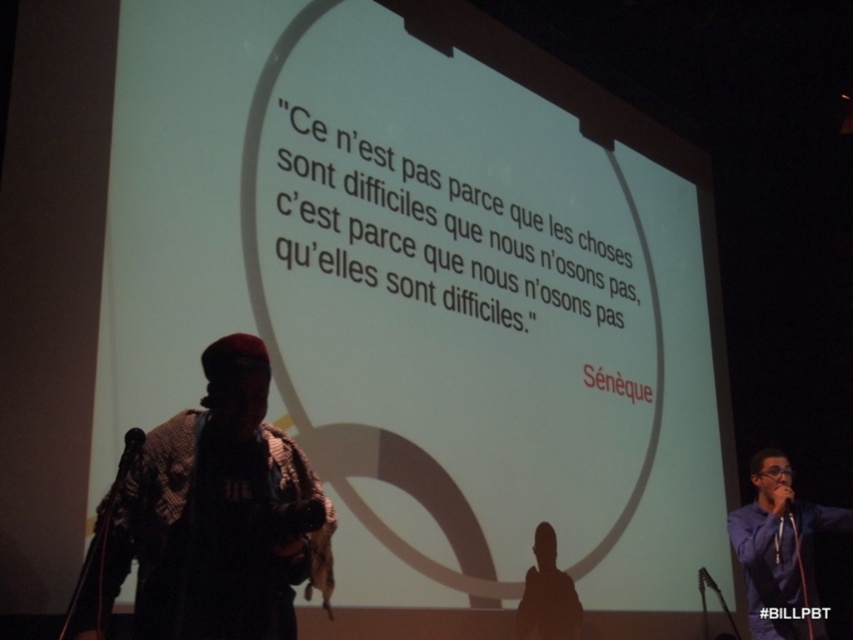
How distant is purple shirt at lower right from transparent plastic microphone at upper right?

A distance of 9.40 inches exists between purple shirt at lower right and transparent plastic microphone at upper right.

Identify the location of purple shirt at lower right. (780, 550).

Which is more to the right, transparent plastic microphone at upper right or black matte microphone at lower left?

transparent plastic microphone at upper right

Is transparent plastic microphone at upper right closer to the viewer compared to black matte microphone at lower left?

That is False.

Locate an element on the screen. The height and width of the screenshot is (640, 853). transparent plastic microphone at upper right is located at coordinates (781, 496).

I want to click on transparent plastic microphone at upper right, so click(x=781, y=496).

Is point (529, 580) more distant than point (135, 440)?

Yes, it is behind point (135, 440).

Is point (563, 628) in front of point (132, 436)?

No, it is not.

Find the location of `black matte silhouette at lower center`. black matte silhouette at lower center is located at coordinates [547, 595].